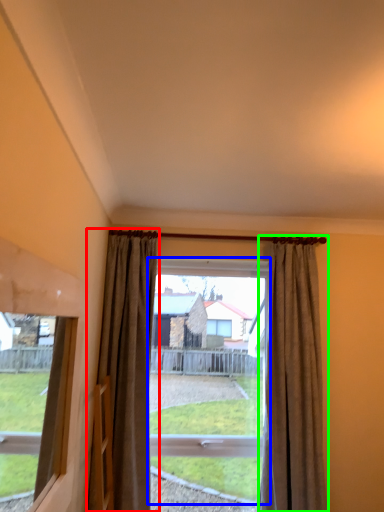
Question: Which is farther away from curtain (highlighted by a red box)? bay window (highlighted by a blue box) or curtain (highlighted by a green box)?

Choices:
 (A) bay window
 (B) curtain

Answer: (A)